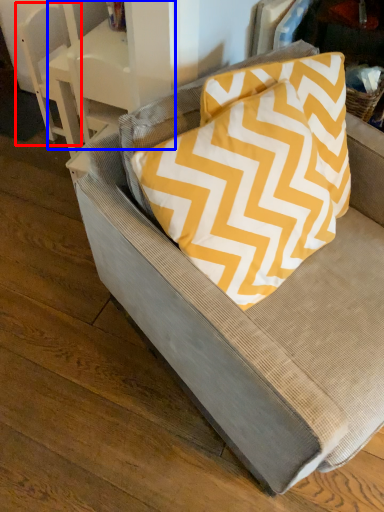
Question: Among these objects, which one is farthest to the camera, armchair (highlighted by a red box) or table (highlighted by a blue box)?

Choices:
 (A) armchair
 (B) table

Answer: (A)